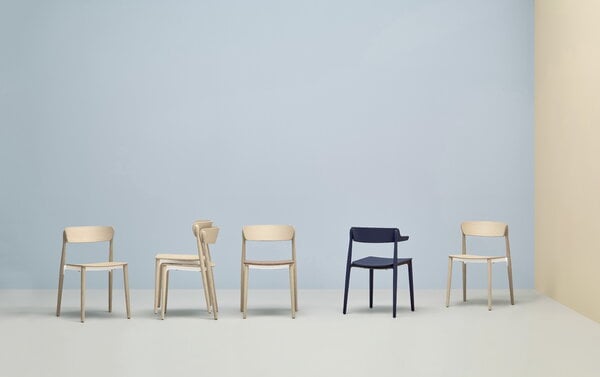
Can you see any where to sit on in the image? Point to them. Your answer should be formatted as a list of tuples, i.e. [(x1, y1), (x2, y2), ...], where each tuple contains the x and y coordinates of a point satisfying the conditions above.

[(96, 265), (169, 257), (266, 262), (380, 257), (478, 254)]